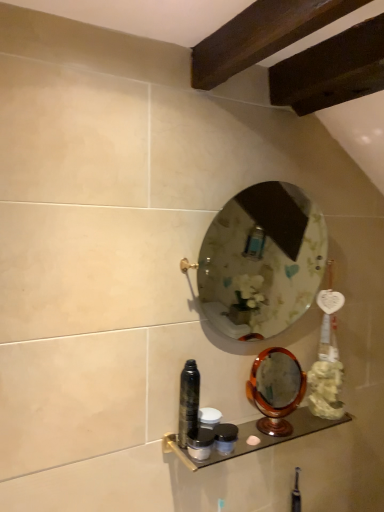
Question: From a real-world perspective, is matte black container at center, acting as the 2th toiletry starting from the bottom, positioned over matte black container at lower center, the 3th toiletry when ordered from bottom to top, based on gravity?

Choices:
 (A) yes
 (B) no

Answer: (B)

Question: Can you confirm if matte black container at center, acting as the 2th toiletry starting from the bottom, is thinner than matte black container at lower center, the 3th toiletry when ordered from bottom to top?

Choices:
 (A) yes
 (B) no

Answer: (A)

Question: From the image's perspective, is matte black container at center, the 3th toiletry from the top, located above matte black container at lower center, the 3th toiletry when ordered from bottom to top?

Choices:
 (A) no
 (B) yes

Answer: (A)

Question: From a real-world perspective, is matte black container at center, the 3th toiletry from the top, under matte black container at lower center, the 3th toiletry when ordered from bottom to top?

Choices:
 (A) yes
 (B) no

Answer: (A)

Question: Considering the relative sizes of matte black container at center, the 3th toiletry from the top, and matte black container at lower center, the 3th toiletry when ordered from bottom to top, in the image provided, is matte black container at center, the 3th toiletry from the top, shorter than matte black container at lower center, the 3th toiletry when ordered from bottom to top,?

Choices:
 (A) yes
 (B) no

Answer: (A)

Question: Is clear glass mirror at center, acting as the 1th mirror starting from the top, inside or outside of matte black container at lower center, which is the fourth toiletry from top to bottom?

Choices:
 (A) outside
 (B) inside

Answer: (A)

Question: In terms of height, does clear glass mirror at center, acting as the 1th mirror starting from the top, look taller or shorter compared to matte black container at lower center, placed as the first toiletry when sorted from bottom to top?

Choices:
 (A) tall
 (B) short

Answer: (A)

Question: Is point (284, 216) closer or farther from the camera than point (213, 428)?

Choices:
 (A) closer
 (B) farther

Answer: (B)

Question: Considering their positions, is clear glass mirror at center, acting as the 1th mirror starting from the top, located in front of or behind matte black container at lower center, which is the fourth toiletry from top to bottom?

Choices:
 (A) front
 (B) behind

Answer: (A)

Question: Choose the correct answer: Is metallic glass shelf at lower center inside matte black container at lower center, which is counted as the 2th toiletry, starting from the top, or outside it?

Choices:
 (A) inside
 (B) outside

Answer: (B)

Question: Is metallic glass shelf at lower center taller or shorter than matte black container at lower center, the 3th toiletry when ordered from bottom to top?

Choices:
 (A) tall
 (B) short

Answer: (B)

Question: Considering the positions of metallic glass shelf at lower center and matte black container at lower center, which is counted as the 2th toiletry, starting from the top, in the image, is metallic glass shelf at lower center bigger or smaller than matte black container at lower center, which is counted as the 2th toiletry, starting from the top,?

Choices:
 (A) big
 (B) small

Answer: (A)

Question: Is metallic glass shelf at lower center wider or thinner than matte black container at lower center, the 3th toiletry when ordered from bottom to top?

Choices:
 (A) wide
 (B) thin

Answer: (A)

Question: Is shiny black can at center, positioned as the first toiletry in top-to-bottom order, inside or outside of metallic glass shelf at lower center?

Choices:
 (A) inside
 (B) outside

Answer: (B)

Question: From the image's perspective, is shiny black can at center, positioned as the first toiletry in top-to-bottom order, located above or below metallic glass shelf at lower center?

Choices:
 (A) below
 (B) above

Answer: (B)